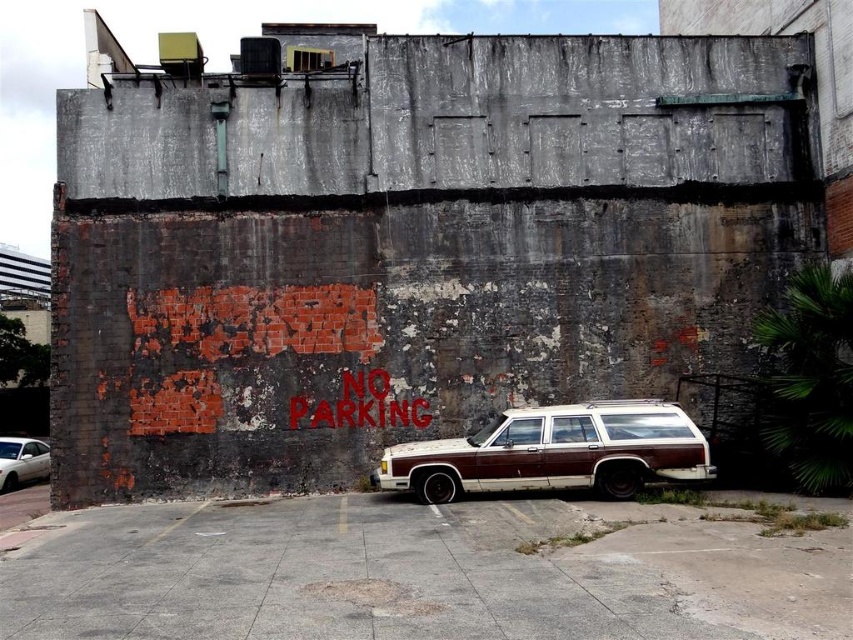
You are standing in front of the wall with the NO PARKING sign. You see the rustic wood station wagon at center and the white matte car at lower left. Which car is nearer to you?

The rustic wood station wagon at center is closer to the viewer than the white matte car at lower left.

You are a delivery person needing to park your white matte car at lower left in a space that can only accommodate vehicles up to the size of the rustic wood station wagon at center. Can your car fit in the space?

The rustic wood station wagon at center is wider than the white matte car at lower left, so the white matte car at lower left can fit in the parking space designed for the rustic wood station wagon at center.

You are a delivery person trying to park your van in the parking lot. You see the rustic wood station wagon at center and the white matte car at lower left. Which vehicle is blocking your path?

The rustic wood station wagon at center is blocking your path because it is positioned over the white matte car at lower left, indicating it is in front of or covering part of the white matte car.